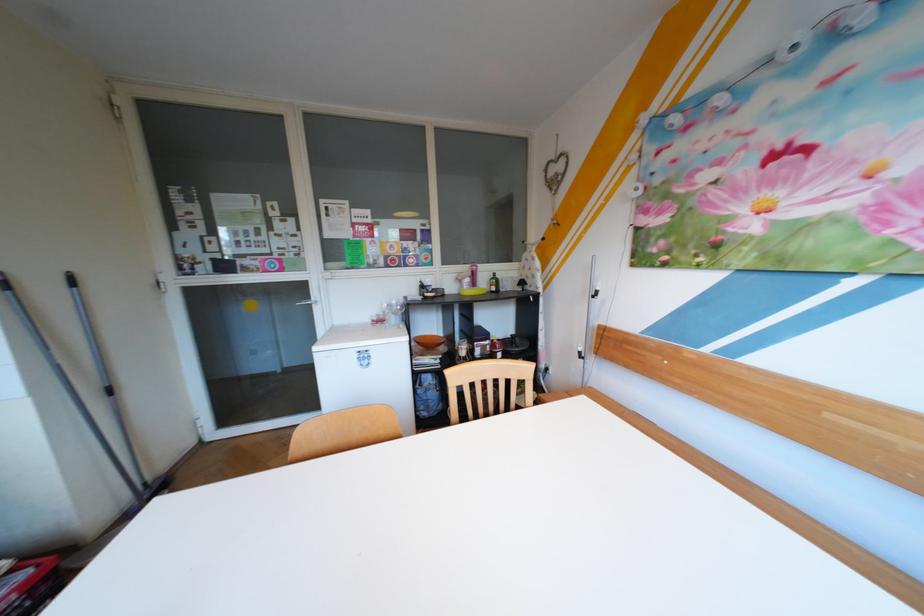
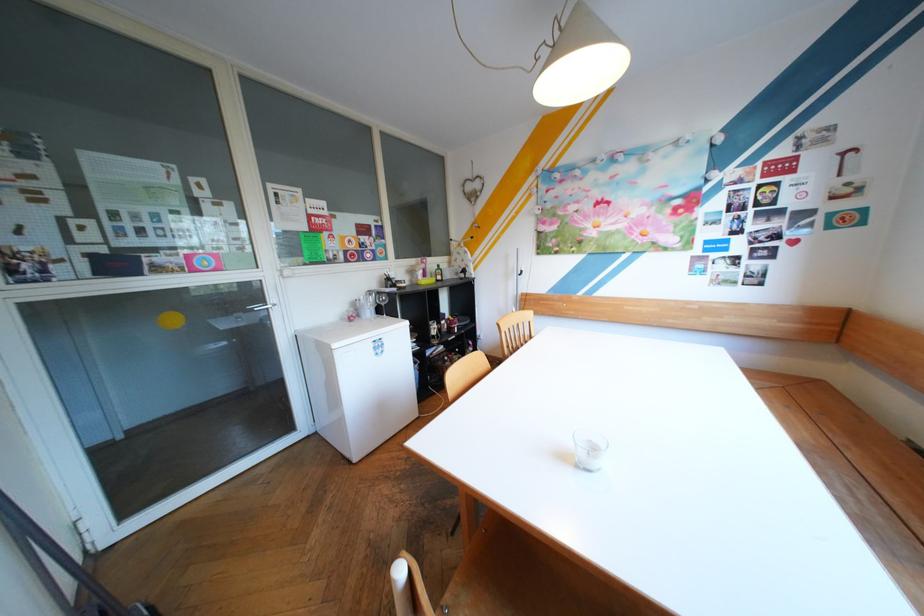
The point at (479, 267) is marked in the first image. Where is the corresponding point in the second image?

(426, 261)